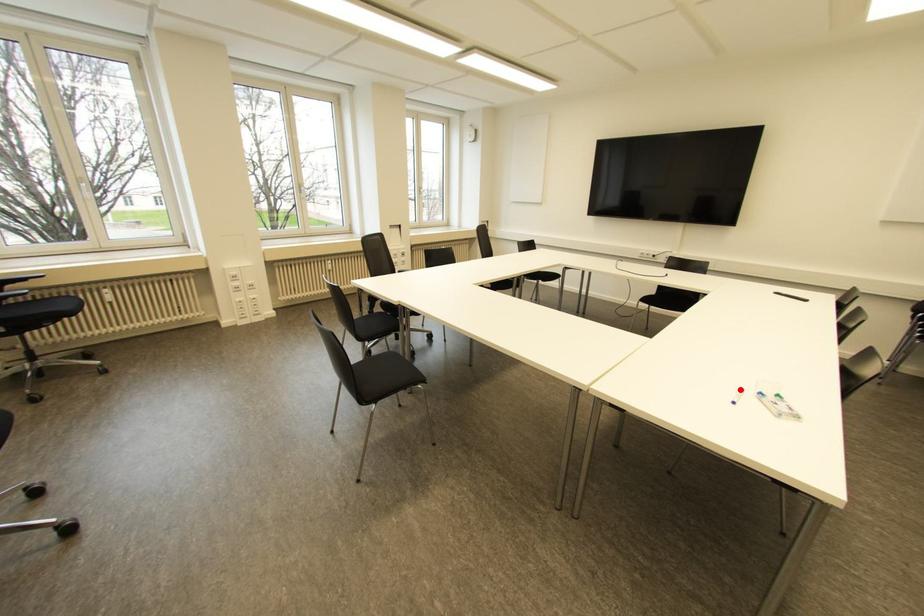
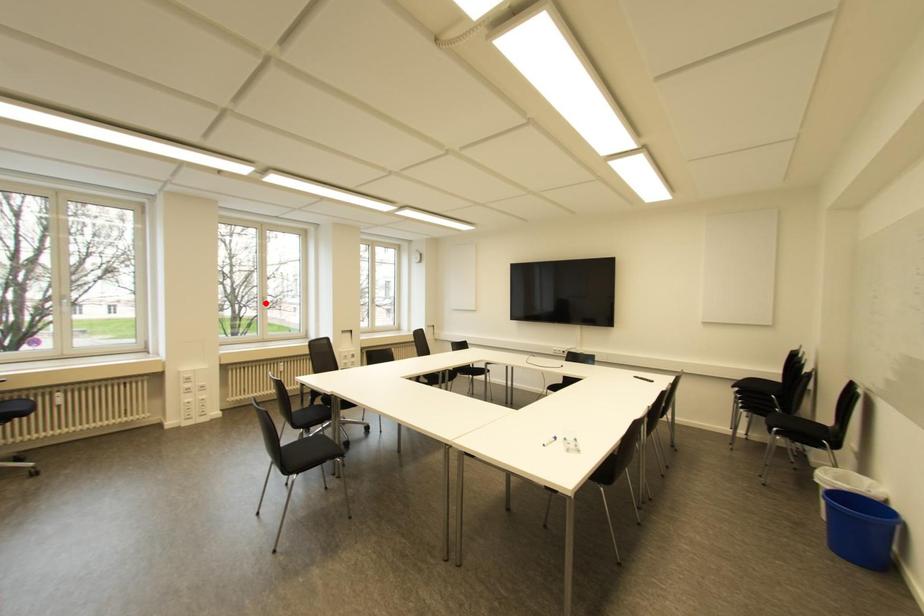
From the picture: I am providing you with two images of the same scene from different viewpoints. A red point is marked on the first image and another point is marked on the second image. Is the red point in image1 aligned with the point shown in image2?

No